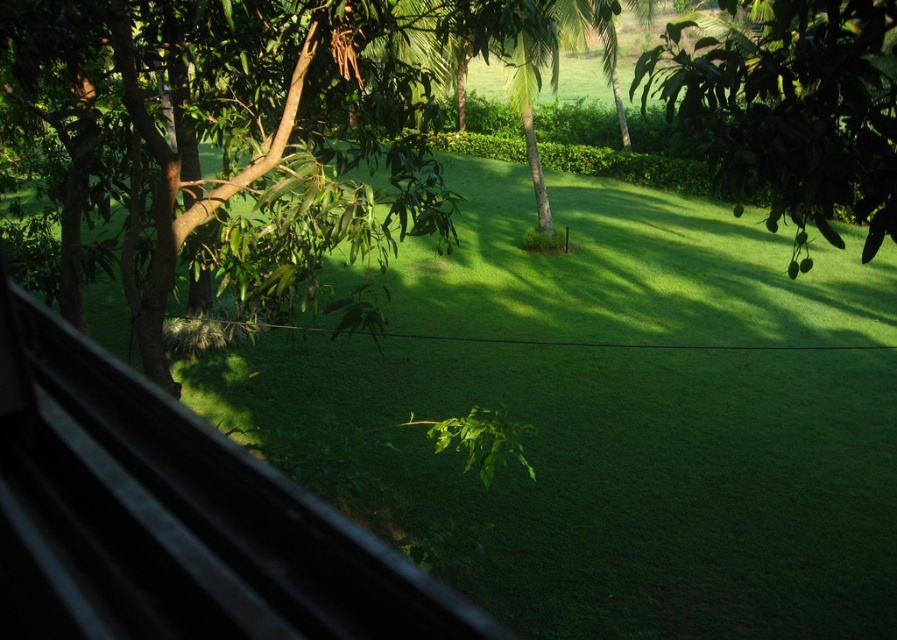
Question: Which point appears closest to the camera in this image?

Choices:
 (A) (848, 116)
 (B) (68, 150)

Answer: (A)

Question: From the image, what is the correct spatial relationship of green leafy tree at upper left in relation to green leafy tree at upper right?

Choices:
 (A) above
 (B) below

Answer: (B)

Question: Does green leafy tree at upper left have a smaller size compared to green leafy tree at upper right?

Choices:
 (A) no
 (B) yes

Answer: (B)

Question: Which object appears farthest from the camera in this image?

Choices:
 (A) green leafy tree at upper right
 (B) green leafy tree at upper left

Answer: (B)

Question: Is green leafy tree at upper left behind green leafy tree at upper right?

Choices:
 (A) yes
 (B) no

Answer: (A)